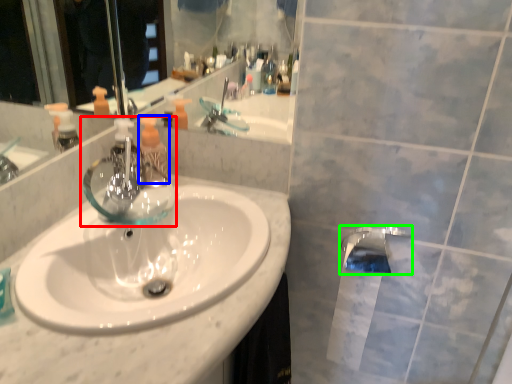
Question: Which is nearer to the tap (highlighted by a red box)? toiletry (highlighted by a blue box) or tap (highlighted by a green box).

Choices:
 (A) toiletry
 (B) tap

Answer: (A)